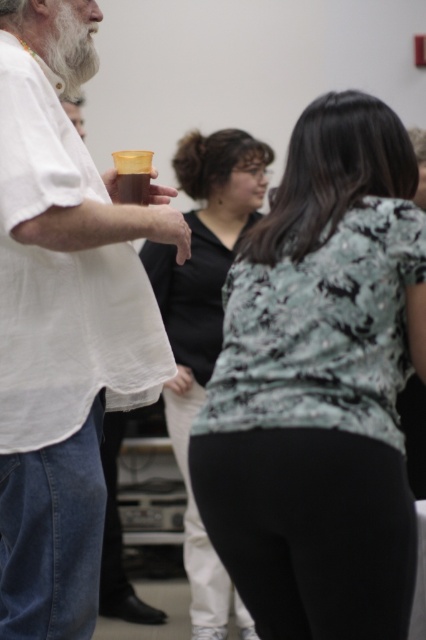
Who is shorter, floral-patterned blouse at center or black matte shirt at center?

floral-patterned blouse at center is shorter.

The image size is (426, 640). Describe the element at coordinates (319, 385) in the screenshot. I see `floral-patterned blouse at center` at that location.

Measure the distance between point [408,340] and camera.

1.71 meters

At what (x,y) coordinates should I click in order to perform the action: click on floral-patterned blouse at center. Please return your answer as a coordinate pair (x, y). Looking at the image, I should click on (319, 385).

Does white matte shirt at upper left have a lesser height compared to black matte shirt at center?

Yes, white matte shirt at upper left is shorter than black matte shirt at center.

You are a GUI agent. You are given a task and a screenshot of the screen. Output one action in this format:
    pyautogui.click(x=<x>, y=<y>)
    Task: Click on the white matte shirt at upper left
    This screenshot has width=426, height=640.
    Given the screenshot: What is the action you would take?
    pyautogui.click(x=62, y=323)

This screenshot has height=640, width=426. What are the coordinates of `white matte shirt at upper left` in the screenshot? It's located at (62, 323).

Between point (402, 500) and point (22, 70), which one is positioned behind?

Point (22, 70)

Is point (275, 467) closer to camera compared to point (28, 129)?

Yes, point (275, 467) is closer to viewer.

What are the coordinates of `floral-patterned blouse at center` in the screenshot? It's located at (319, 385).